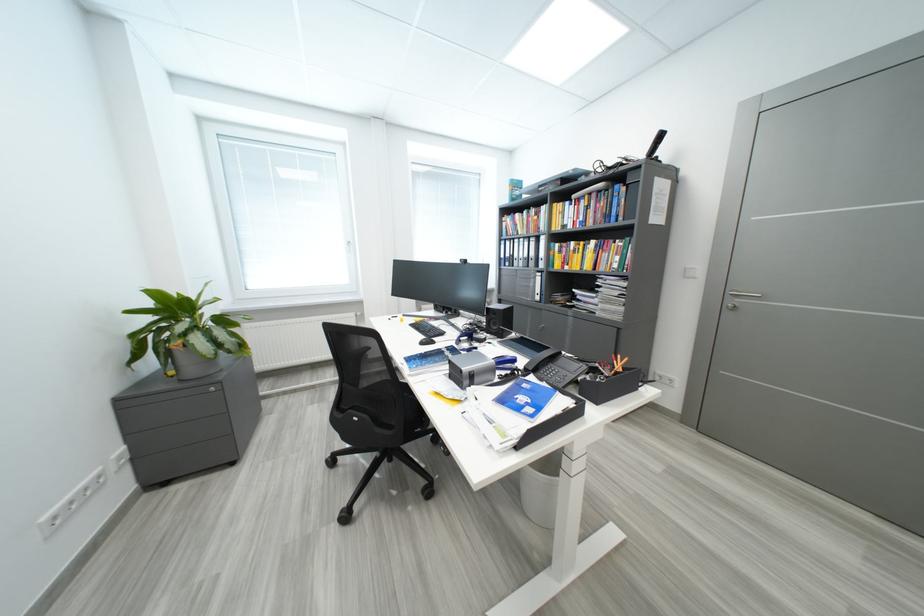
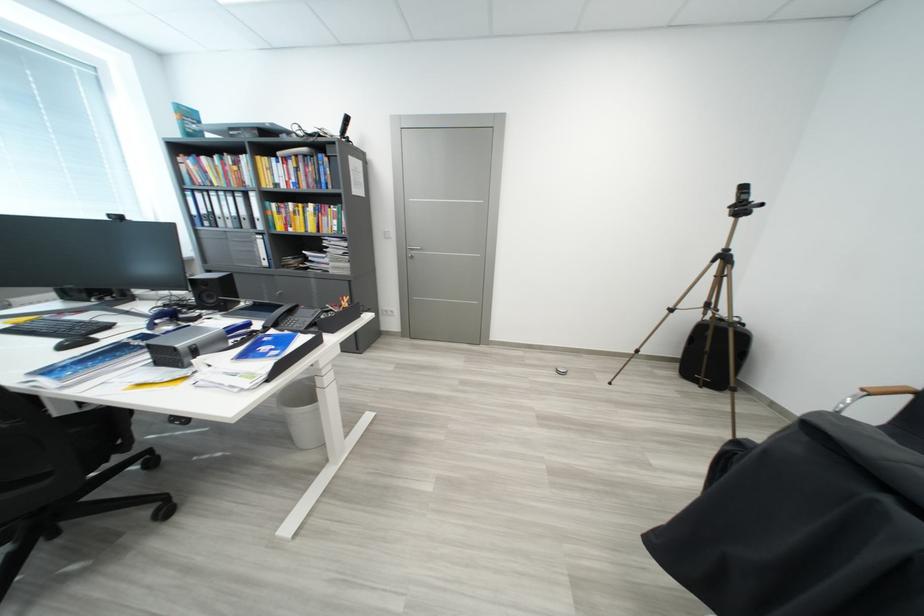
Question: The camera is either moving clockwise (left) or counter-clockwise (right) around the object. The first image is from the beginning of the video and the second image is from the end. Is the camera moving left or right when shooting the video?

Choices:
 (A) Left
 (B) Right

Answer: (A)